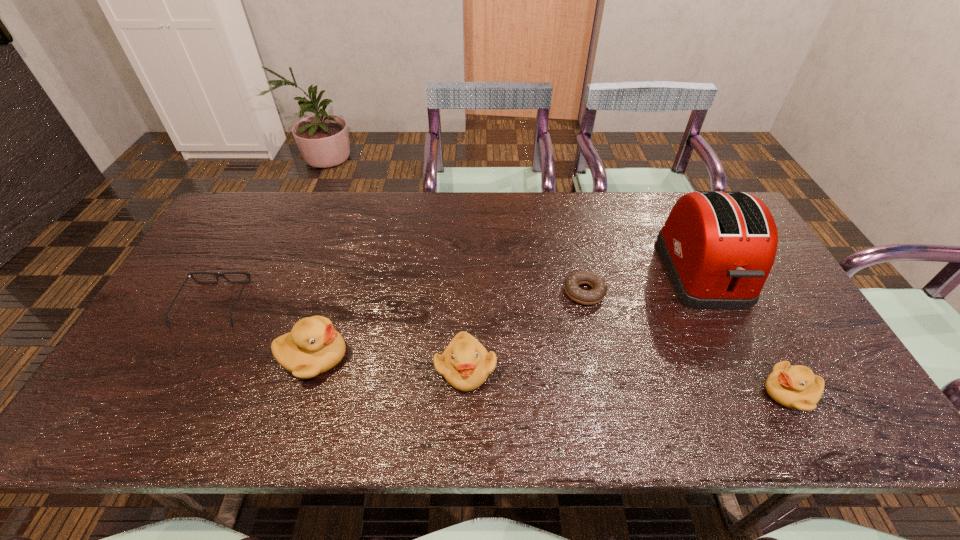
Where is `vacant space located at the beak of the shortest duckling`? The image size is (960, 540). vacant space located at the beak of the shortest duckling is located at coordinates (669, 393).

Identify the location of vacant space located at the beak of the shortest duckling. (660, 393).

You are a GUI agent. You are given a task and a screenshot of the screen. Output one action in this format:
    pyautogui.click(x=<x>, y=<y>)
    Task: Click on the vacant area situated on the front-facing side of the leftmost object
    This screenshot has height=540, width=960.
    Given the screenshot: What is the action you would take?
    pyautogui.click(x=243, y=249)

The image size is (960, 540). I want to click on free location located on the front-facing side of the leftmost object, so click(x=254, y=229).

The width and height of the screenshot is (960, 540). Find the location of `vacant space located on the front-facing side of the leftmost object`. vacant space located on the front-facing side of the leftmost object is located at coordinates (239, 256).

The height and width of the screenshot is (540, 960). Identify the location of vacant space located 0.330m on the left of the tallest object. (555, 273).

Image resolution: width=960 pixels, height=540 pixels. What are the coordinates of `free space located 0.330m on the back of the fourth object from left to right` in the screenshot? It's located at (565, 208).

Find the location of a particular element. object positioned at the far edge is located at coordinates (718, 247).

Where is `object that is at the left edge`? object that is at the left edge is located at coordinates (190, 275).

In order to click on duckling present at the right edge in this screenshot , I will do (x=796, y=387).